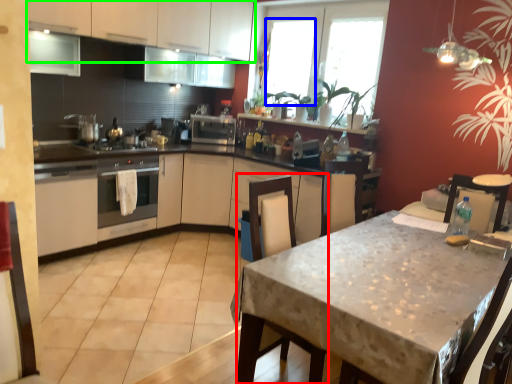
Question: Considering the real-world distances, which object is farthest from swivel chair (highlighted by a red box)? window (highlighted by a blue box) or cabinetry (highlighted by a green box)?

Choices:
 (A) window
 (B) cabinetry

Answer: (A)